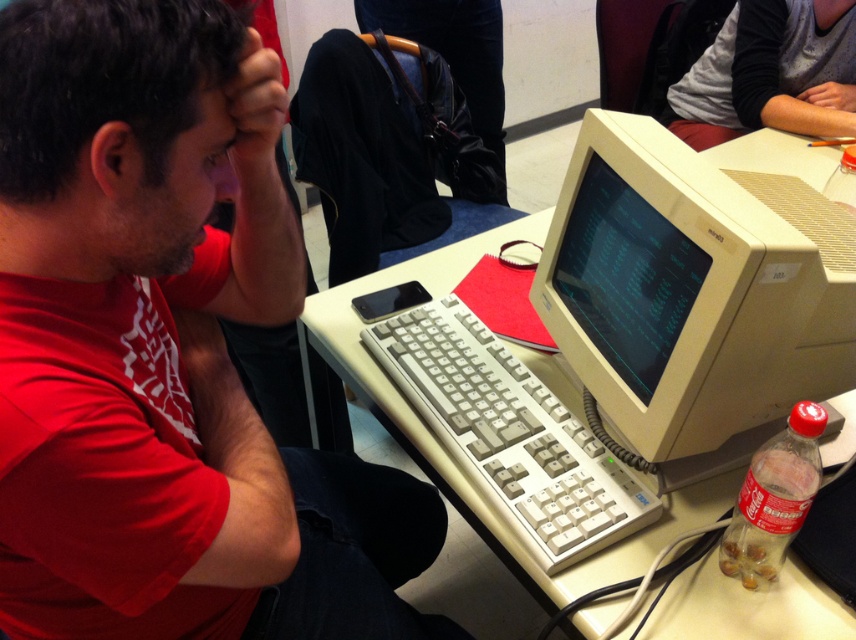
Question: In this image, where is matte red shirt at left located relative to gray fabric shirt at upper right?

Choices:
 (A) below
 (B) above

Answer: (A)

Question: Can you confirm if matte red shirt at left is bigger than beige plastic monitor at center?

Choices:
 (A) no
 (B) yes

Answer: (B)

Question: Which point appears closest to the camera in this image?

Choices:
 (A) (64, 412)
 (B) (777, 45)

Answer: (A)

Question: Which object appears farthest from the camera in this image?

Choices:
 (A) white plastic table at center
 (B) gray fabric shirt at upper right

Answer: (B)

Question: Does beige plastic monitor at center have a smaller size compared to white plastic table at center?

Choices:
 (A) yes
 (B) no

Answer: (A)

Question: Which point is closer to the camera?

Choices:
 (A) (569, 227)
 (B) (444, 605)

Answer: (A)